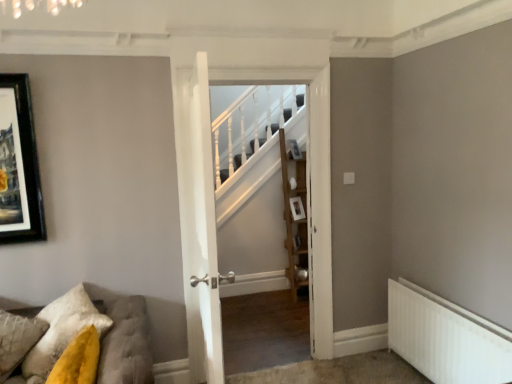
Question: Is white metallic radiator at lower right wider than white wooden door at center, which ranks as the second door in back-to-front order?

Choices:
 (A) no
 (B) yes

Answer: (A)

Question: Considering the relative positions of white metallic radiator at lower right and white wooden door at center, the 1th door when ordered from front to back, in the image provided, is white metallic radiator at lower right in front of white wooden door at center, the 1th door when ordered from front to back,?

Choices:
 (A) no
 (B) yes

Answer: (A)

Question: Does white metallic radiator at lower right have a larger size compared to white wooden door at center, the 1th door when ordered from front to back?

Choices:
 (A) yes
 (B) no

Answer: (B)

Question: Is white metallic radiator at lower right not near white wooden door at center, the 1th door when ordered from front to back?

Choices:
 (A) yes
 (B) no

Answer: (A)

Question: Is white metallic radiator at lower right facing away from white wooden door at center, which ranks as the second door in back-to-front order?

Choices:
 (A) no
 (B) yes

Answer: (A)

Question: From the image's perspective, would you say white metallic radiator at lower right is positioned over white wooden door at center, which ranks as the second door in back-to-front order?

Choices:
 (A) yes
 (B) no

Answer: (B)

Question: From a real-world perspective, is tufted fabric sofa at lower left over textured yellow pillow at lower left?

Choices:
 (A) yes
 (B) no

Answer: (B)

Question: Is tufted fabric sofa at lower left touching textured yellow pillow at lower left?

Choices:
 (A) no
 (B) yes

Answer: (A)

Question: From the image's perspective, is tufted fabric sofa at lower left on textured yellow pillow at lower left?

Choices:
 (A) no
 (B) yes

Answer: (A)

Question: Is tufted fabric sofa at lower left far away from textured yellow pillow at lower left?

Choices:
 (A) no
 (B) yes

Answer: (A)

Question: Is tufted fabric sofa at lower left further to the viewer compared to textured yellow pillow at lower left?

Choices:
 (A) yes
 (B) no

Answer: (B)

Question: Does tufted fabric sofa at lower left have a lesser height compared to textured yellow pillow at lower left?

Choices:
 (A) no
 (B) yes

Answer: (A)

Question: Is tufted fabric sofa at lower left directly adjacent to white wooden door at center, which is counted as the 2th door, starting from the front?

Choices:
 (A) no
 (B) yes

Answer: (A)